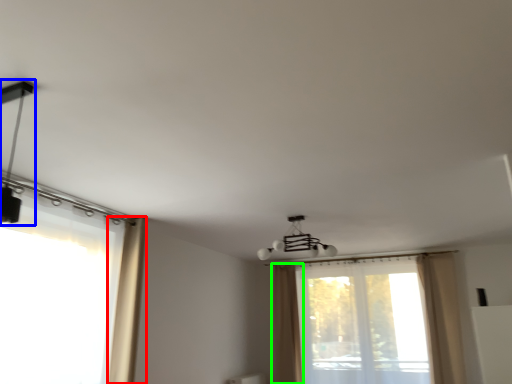
Question: Which is farther away from curtain (highlighted by a red box)? lamp (highlighted by a blue box) or curtain (highlighted by a green box)?

Choices:
 (A) lamp
 (B) curtain

Answer: (B)